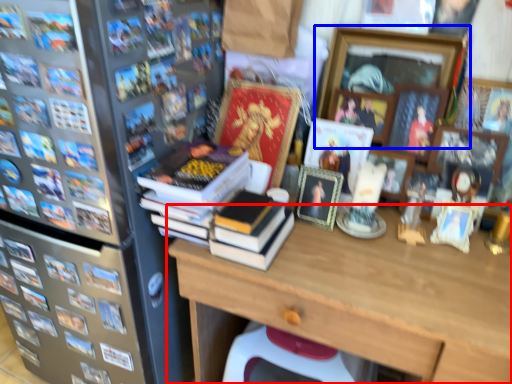
Question: Which object appears closest to the camera in this image, desk (highlighted by a red box) or picture frame (highlighted by a blue box)?

Choices:
 (A) desk
 (B) picture frame

Answer: (A)